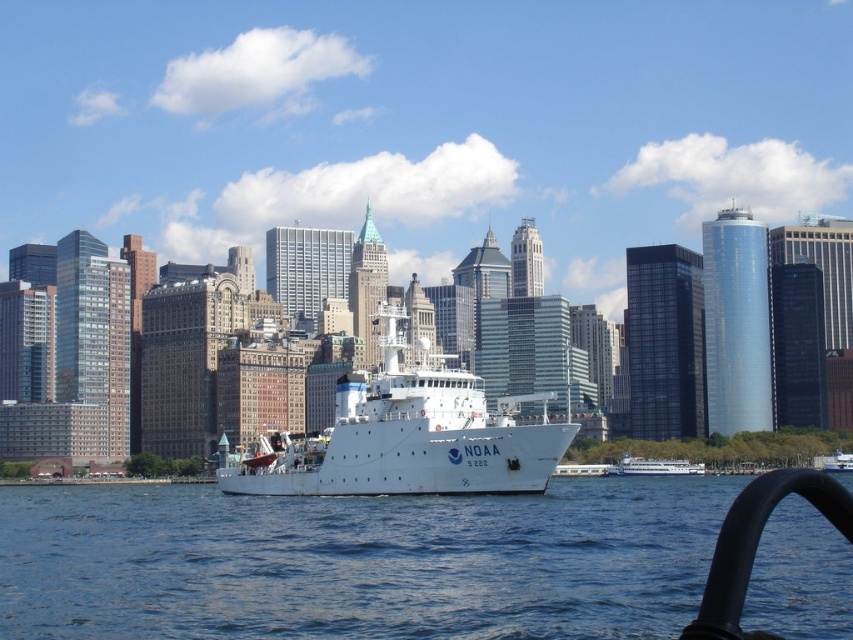
You are a marine biologist on a NOAA ship and need to collect water samples from the blue water at center. The ship you are on is the white matte ship at center. Can you safely lower a 15 meter long sampling device from the ship to the water without it touching the bottom?

The blue water at center is 18.01 meters away from the white matte ship at center. Since the sampling device is 15 meters long, it can be safely lowered without touching the bottom as the depth is sufficient.

You are on a boat and need to navigate between the blue water at center and the white glossy ferry at center. Which one is closer to your current position?

The blue water at center is closer to the viewer than the white glossy ferry at center, so the blue water at center is closer to your current position.